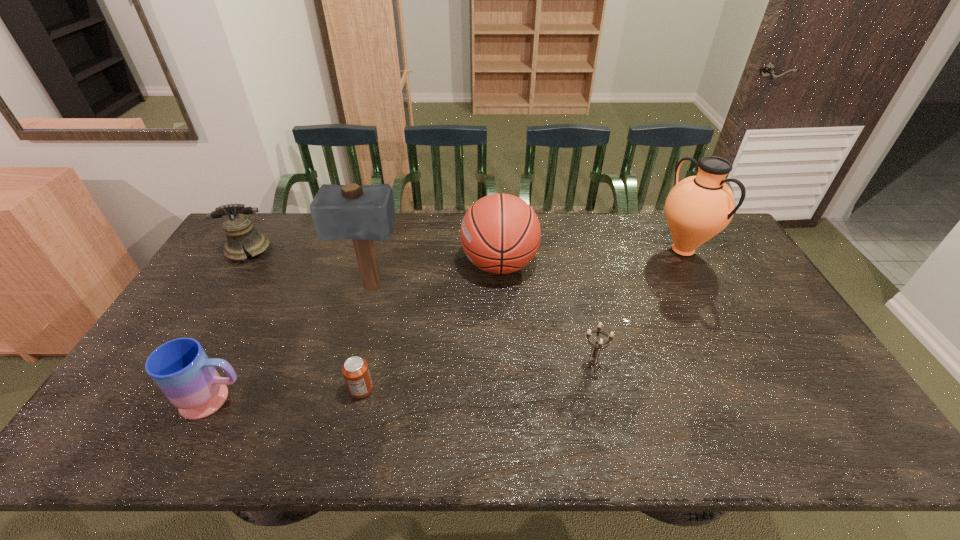
Locate an element on the screen. vacant position at the left edge of the desktop is located at coordinates (233, 314).

In the image, there is a desktop. Where is `free space at the right edge`? The width and height of the screenshot is (960, 540). free space at the right edge is located at coordinates (735, 273).

Where is `vacant area that lies between the mug and the fifth shortest object`? The width and height of the screenshot is (960, 540). vacant area that lies between the mug and the fifth shortest object is located at coordinates (357, 332).

Locate an element on the screen. The height and width of the screenshot is (540, 960). vacant area between the shortest object and the mallet is located at coordinates (367, 339).

Locate an element on the screen. free space between the mug and the mallet is located at coordinates (294, 344).

Locate an element on the screen. unoccupied position between the bell and the third nearest object is located at coordinates (420, 308).

At what (x,y) coordinates should I click in order to perform the action: click on vacant area that lies between the shortest object and the mug. Please return your answer as a coordinate pair (x, y). The image size is (960, 540). Looking at the image, I should click on (288, 394).

Find the location of `vacant area between the bell and the mallet`. vacant area between the bell and the mallet is located at coordinates (310, 269).

This screenshot has width=960, height=540. Find the location of `free space that is in between the can and the candle holder`. free space that is in between the can and the candle holder is located at coordinates 476,377.

The image size is (960, 540). In order to click on empty space that is in between the fifth shortest object and the can in this screenshot , I will do `click(430, 327)`.